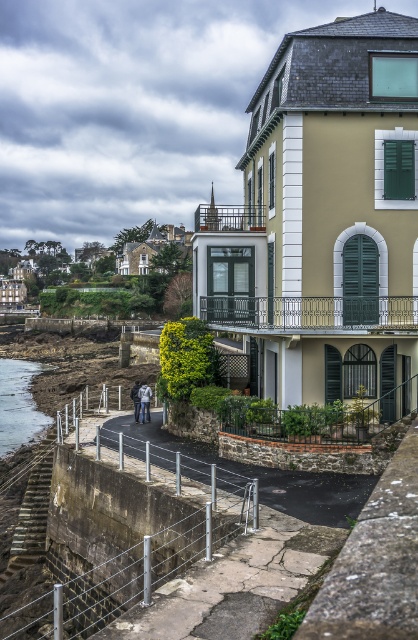
Question: Among these objects, which one is farthest from the camera?

Choices:
 (A) green matte shutter at center-right
 (B) green matte shutter at upper right
 (C) denim jacket at lower left
 (D) dark gray jacket at lower center

Answer: (D)

Question: Is green matte shutter at center-right wider than green matte shutter at upper right?

Choices:
 (A) no
 (B) yes

Answer: (B)

Question: Can you confirm if green matte shutter at center-right is positioned above dark gray jacket at lower center?

Choices:
 (A) no
 (B) yes

Answer: (B)

Question: Estimate the real-world distances between objects in this image. Which object is closer to the green matte shutter at upper right?

Choices:
 (A) green matte shutter at center-right
 (B) denim jacket at lower left
 (C) clear water at lower left

Answer: (A)

Question: Can you confirm if green matte shutter at center-right is wider than dark gray jacket at lower center?

Choices:
 (A) no
 (B) yes

Answer: (A)

Question: Which point is closer to the camera taking this photo?

Choices:
 (A) (140, 403)
 (B) (22, 428)
 (C) (349, 314)

Answer: (C)